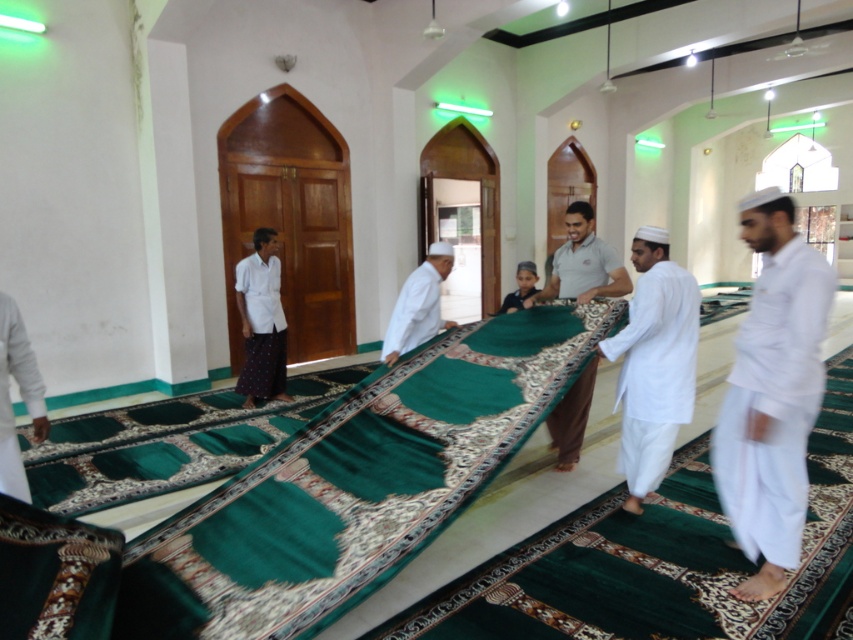
You are standing at the entrance of the mosque and want to approach the person wearing the white matte robe at lower left. Based on their position in the scene, which direction should you walk to reach them?

The white matte robe at lower left is located at point (x=20, y=396), which means it is positioned to the right and slightly forward from the entrance. You should walk towards the right side of the prayer hall to reach them.

Based on the photo, you are a visitor entering the mosque and need to place your prayer mat. The white matte prayer mat at center and the dark green fabric at center are already on the floor. Which one is taller and should you avoid stepping on?

The white matte prayer mat at center is much taller than the dark green fabric at center, so you should avoid stepping on the white matte prayer mat at center as it is elevated.

You are standing at the entrance of the mosque and want to place a new prayer mat exactly where the white matte prayer mat at center is currently located. What are the coordinates where you should place it?

The white matte prayer mat at center is located at coordinates [418,305], so you should place the new prayer mat at those exact coordinates.